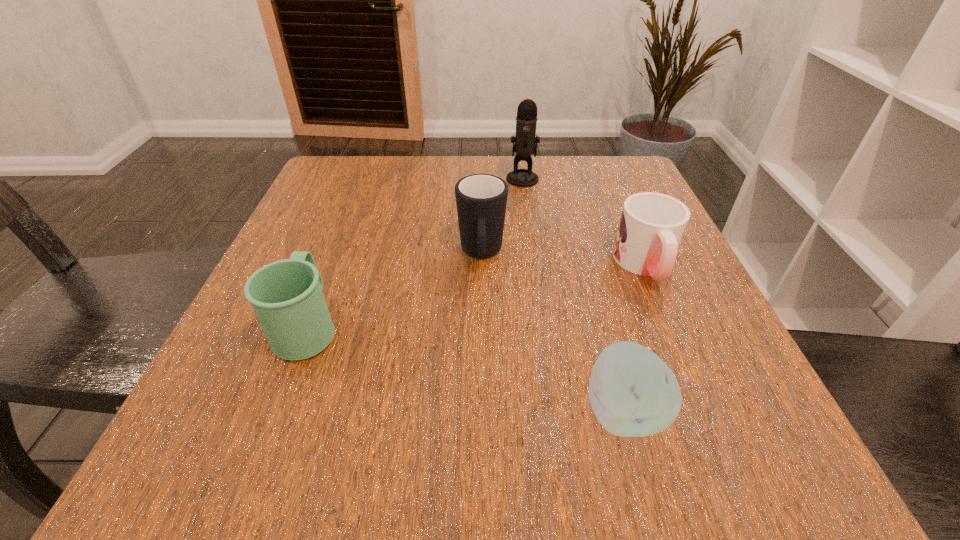
The height and width of the screenshot is (540, 960). I want to click on vacant space at the far edge of the desktop, so (540, 164).

The width and height of the screenshot is (960, 540). What are the coordinates of `free spot at the near edge of the desktop` in the screenshot? It's located at (299, 484).

What are the coordinates of `vacant space at the left edge` in the screenshot? It's located at point(330,230).

Where is `vacant space at the right edge`? This screenshot has width=960, height=540. vacant space at the right edge is located at coordinates (626, 294).

At what (x,y) coordinates should I click in order to perform the action: click on vacant space at the far left corner of the desktop. Please return your answer as a coordinate pair (x, y). Looking at the image, I should click on (334, 171).

This screenshot has width=960, height=540. What are the coordinates of `vacant space at the far right corner` in the screenshot? It's located at (578, 199).

You are a GUI agent. You are given a task and a screenshot of the screen. Output one action in this format:
    pyautogui.click(x=<x>, y=<y>)
    Task: Click on the free point between the nearest object and the rightmost mug
    This screenshot has width=960, height=540.
    Given the screenshot: What is the action you would take?
    pyautogui.click(x=634, y=338)

In order to click on empty space between the microphone and the nearest object in this screenshot , I will do `click(572, 295)`.

Locate an element on the screen. This screenshot has height=540, width=960. vacant point located between the apple and the leftmost mug is located at coordinates (466, 369).

At what (x,y) coordinates should I click in order to perform the action: click on free spot between the second mug from right to left and the leftmost object. Please return your answer as a coordinate pair (x, y). Looking at the image, I should click on (395, 291).